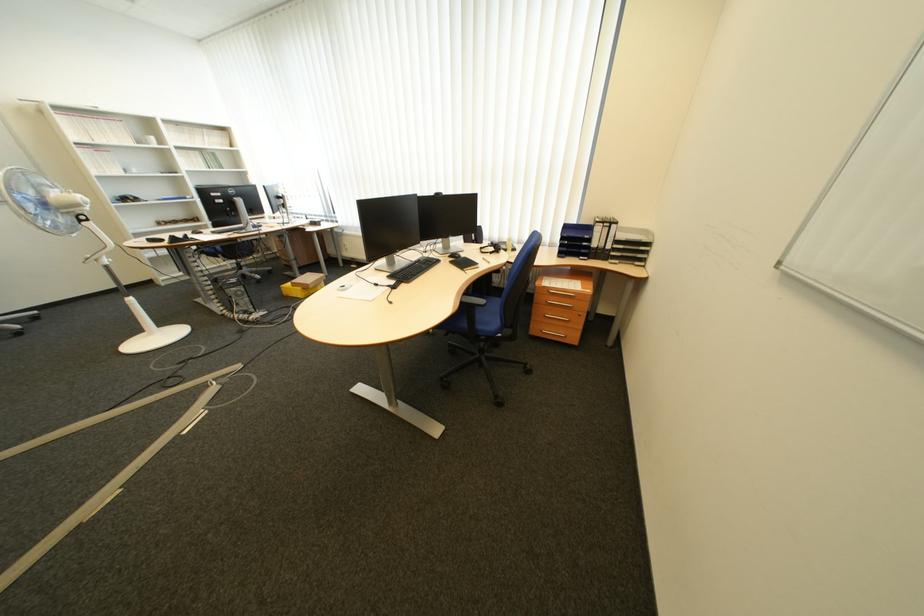
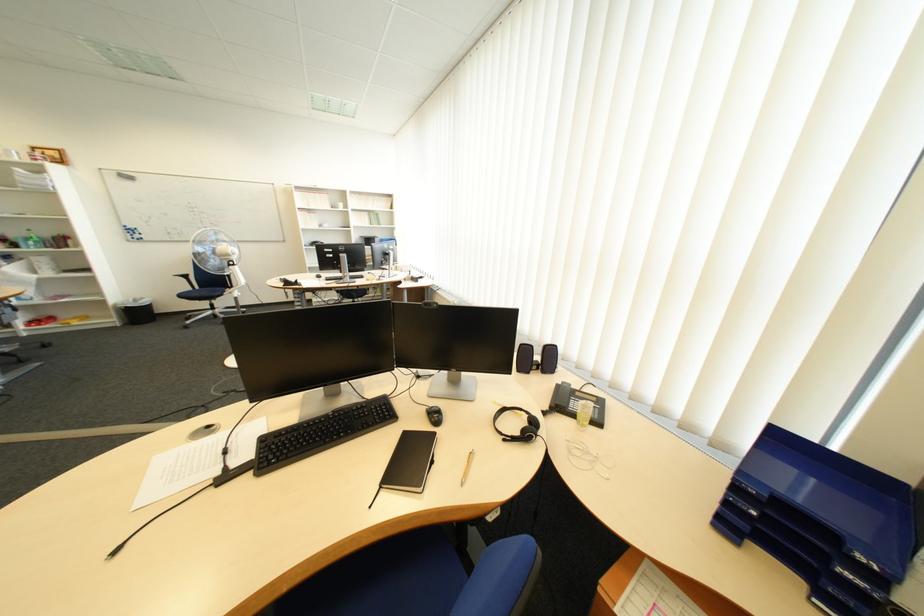
Find the pixel in the second image that matches point (494, 249) in the first image.

(517, 411)